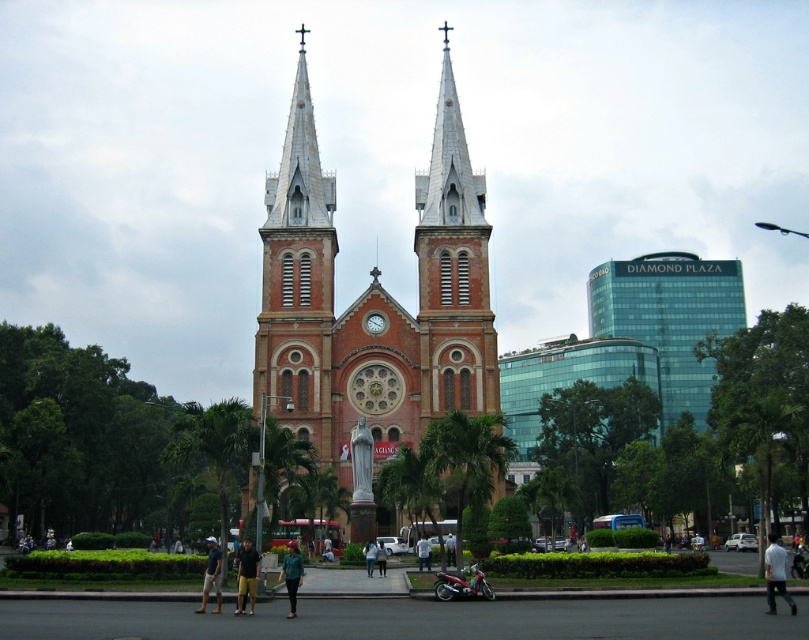
Question: Which is farther from the green fabric dress at center?

Choices:
 (A) light blue denim jeans at center
 (B) white cotton shirt at lower right
 (C) yellow shorts at center

Answer: (B)

Question: Which point is farther to the camera?

Choices:
 (A) white cotton shirt at center
 (B) red brick church at center
 (C) yellow shorts at center
 (D) white cotton shirt at lower right

Answer: (A)

Question: Is dark blue shirt at lower center wider than light blue denim jeans at center?

Choices:
 (A) yes
 (B) no

Answer: (A)

Question: Which of the following is the closest to the observer?

Choices:
 (A) yellow shorts at center
 (B) white cotton shirt at center

Answer: (A)

Question: Does white cotton shirt at lower right have a lesser width compared to light blue denim jeans at center?

Choices:
 (A) yes
 (B) no

Answer: (B)

Question: Where is white cotton shirt at lower right located in relation to white cotton shirt at center in the image?

Choices:
 (A) left
 (B) right

Answer: (B)